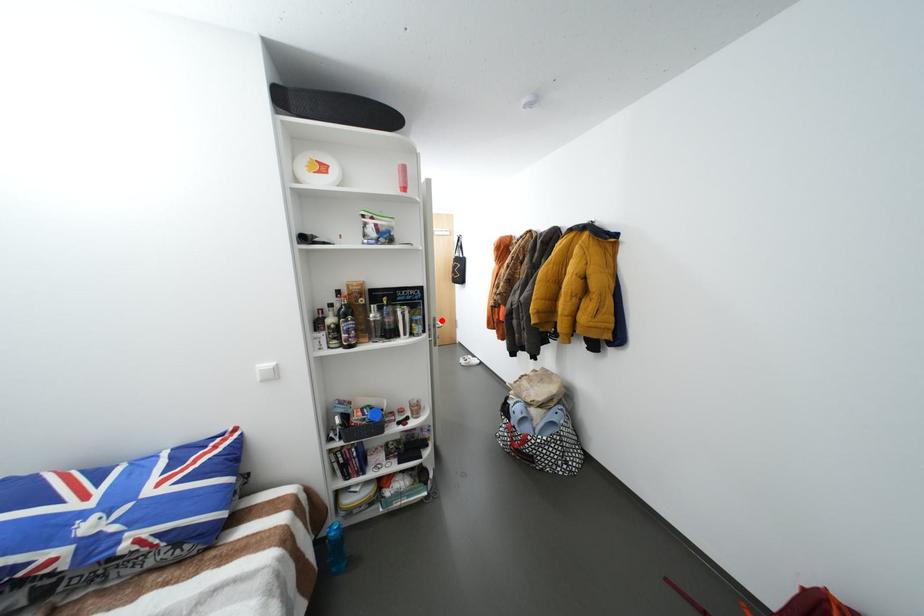
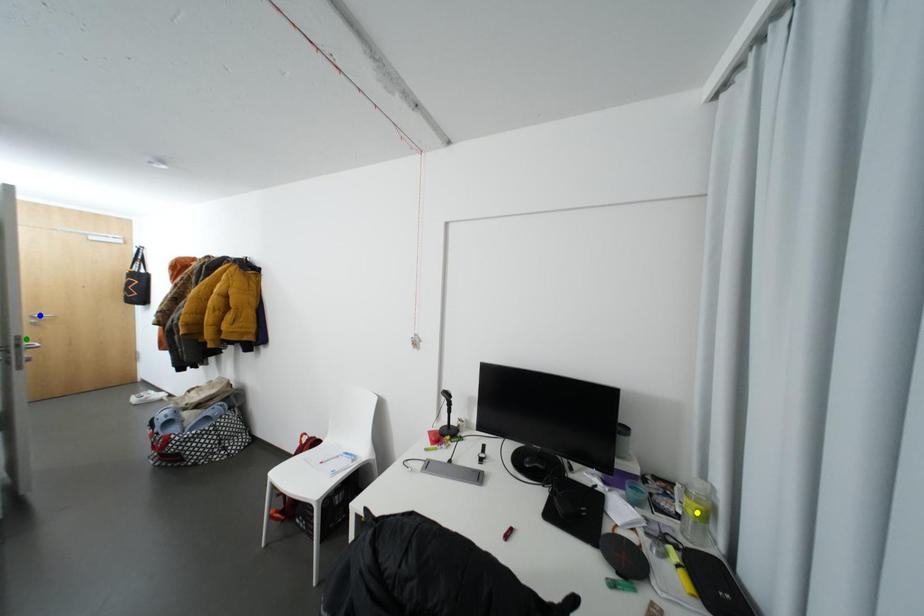
Question: I am providing you with two images of the same scene from different viewpoints. A red point is marked on the first image. You are given multiple points on the second image. Which point in image 2 represents the same 3d spot as the red point in image 1?

Choices:
 (A) yellow point
 (B) green point
 (C) blue point

Answer: (B)